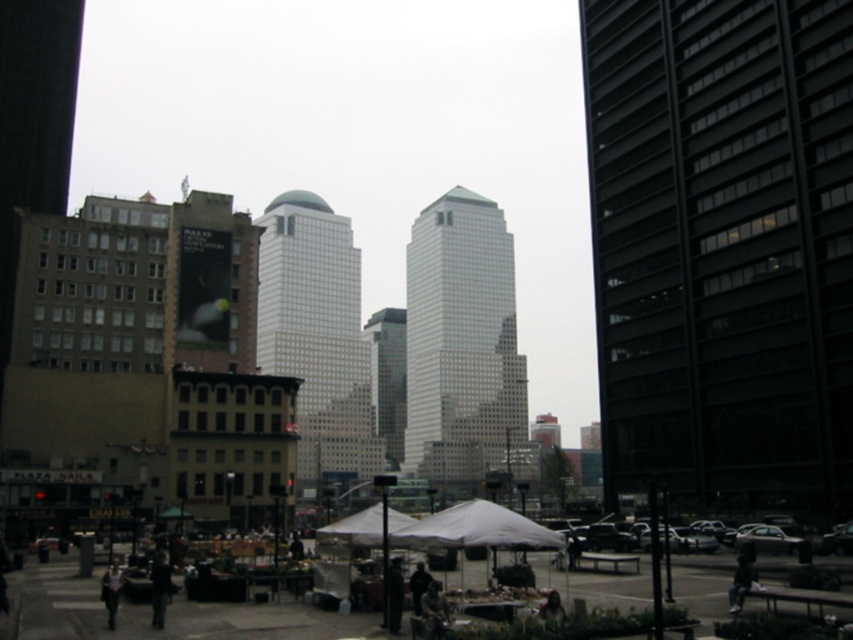
Does dark gray suit at lower left have a lesser width compared to green fabric umbrella at center?

In fact, dark gray suit at lower left might be wider than green fabric umbrella at center.

Who is more distant from viewer, (114, 577) or (555, 614)?

The point (114, 577) is behind.

Is point (109, 614) less distant than point (555, 600)?

No.

Find the location of a particular element. The width and height of the screenshot is (853, 640). dark gray suit at lower left is located at coordinates (111, 589).

Is point (805, 424) more distant than point (743, 588)?

Yes, point (805, 424) is behind point (743, 588).

Does dark glass skyscraper at center have a greater height compared to dark blue jeans at lower right?

Indeed, dark glass skyscraper at center has a greater height compared to dark blue jeans at lower right.

Identify the location of dark glass skyscraper at center. The image size is (853, 640). (722, 244).

This screenshot has height=640, width=853. In order to click on dark glass skyscraper at center in this screenshot , I will do `click(722, 244)`.

Between dark glass skyscraper at center and white glass skyscraper at center, which one appears on the right side from the viewer's perspective?

dark glass skyscraper at center is more to the right.

Is point (775, 410) positioned in front of point (354, 252)?

Yes, point (775, 410) is closer to viewer.

Identify the location of dark glass skyscraper at center. This screenshot has width=853, height=640. (722, 244).